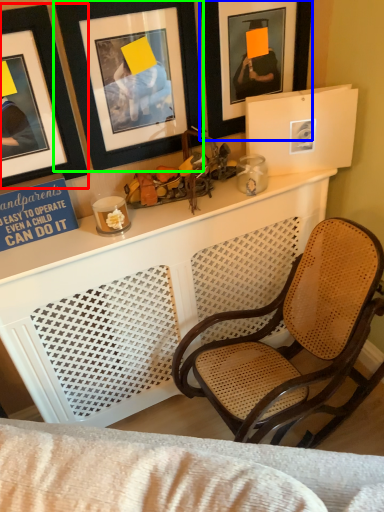
Question: Based on their relative distances, which object is nearer to picture frame (highlighted by a red box)? Choose from picture frame (highlighted by a blue box) and picture frame (highlighted by a green box).

Choices:
 (A) picture frame
 (B) picture frame

Answer: (B)